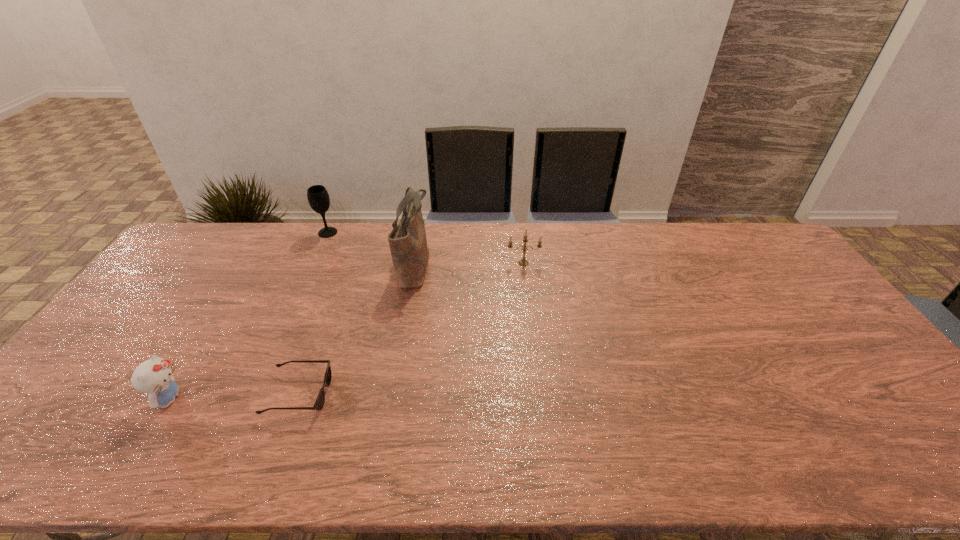
Where is `free space located 0.070m on the front-facing side of the kitten`? Image resolution: width=960 pixels, height=540 pixels. free space located 0.070m on the front-facing side of the kitten is located at coordinates (213, 399).

You are a GUI agent. You are given a task and a screenshot of the screen. Output one action in this format:
    pyautogui.click(x=<x>, y=<y>)
    Task: Click on the vacant region located 0.090m on the front lenses of the sunglasses
    The image size is (960, 540).
    Given the screenshot: What is the action you would take?
    pyautogui.click(x=364, y=394)

Locate an element on the screen. shoulder bag that is at the far edge is located at coordinates (408, 244).

What are the coordinates of `wineglass at the far edge` in the screenshot? It's located at (317, 195).

Where is `candle that is at the far edge`? Image resolution: width=960 pixels, height=540 pixels. candle that is at the far edge is located at coordinates (522, 262).

Find the location of `vacant space at the far edge of the desktop`. vacant space at the far edge of the desktop is located at coordinates (571, 242).

In the image, there is a desktop. At what (x,y) coordinates should I click in order to perform the action: click on vacant space at the near edge. Please return your answer as a coordinate pair (x, y). This screenshot has width=960, height=540. Looking at the image, I should click on (399, 440).

At what (x,y) coordinates should I click in order to perform the action: click on vacant space at the right edge of the desktop. Please return your answer as a coordinate pair (x, y). Looking at the image, I should click on (798, 295).

Locate an element on the screen. This screenshot has height=540, width=960. vacant region at the far right corner is located at coordinates (737, 245).

Where is `vacant area that lies between the tallest object and the sunglasses`? vacant area that lies between the tallest object and the sunglasses is located at coordinates (356, 329).